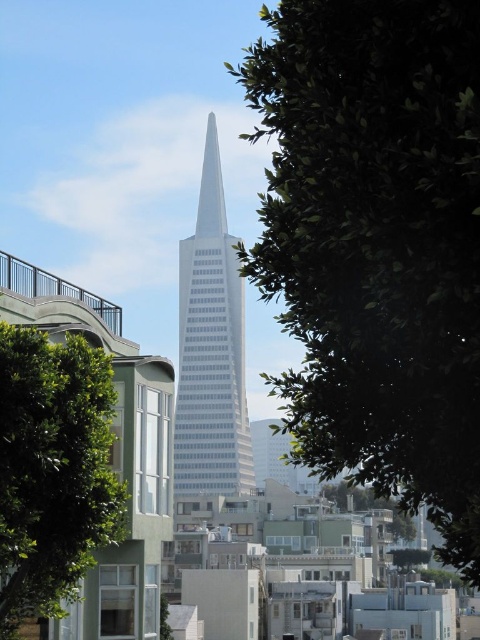
Can you confirm if green leafy tree at center is positioned to the right of white glass skyscraper at center?

Yes, green leafy tree at center is to the right of white glass skyscraper at center.

Based on the photo, who is more forward, (456, 273) or (181, 342)?

Positioned in front is point (456, 273).

Locate an element on the screen. green leafy tree at center is located at coordinates (376, 244).

Between green leafy tree at center and green leafy tree at lower left, which one is positioned higher?

green leafy tree at center is higher up.

Who is more forward, [479,308] or [46,611]?

Positioned in front is point [479,308].

At what (x,y) coordinates should I click in order to perform the action: click on green leafy tree at center. Please return your answer as a coordinate pair (x, y). This screenshot has height=640, width=480. Looking at the image, I should click on click(376, 244).

Does point (41, 515) come in front of point (194, 336)?

Yes, point (41, 515) is closer to viewer.

Is green leafy tree at lower left further to camera compared to white glass skyscraper at center?

No.

Between point (34, 556) and point (179, 321), which one is positioned behind?

Positioned behind is point (179, 321).

At what (x,y) coordinates should I click in order to perform the action: click on green leafy tree at lower left. Please return your answer as a coordinate pair (x, y). The width and height of the screenshot is (480, 640). Looking at the image, I should click on (52, 470).